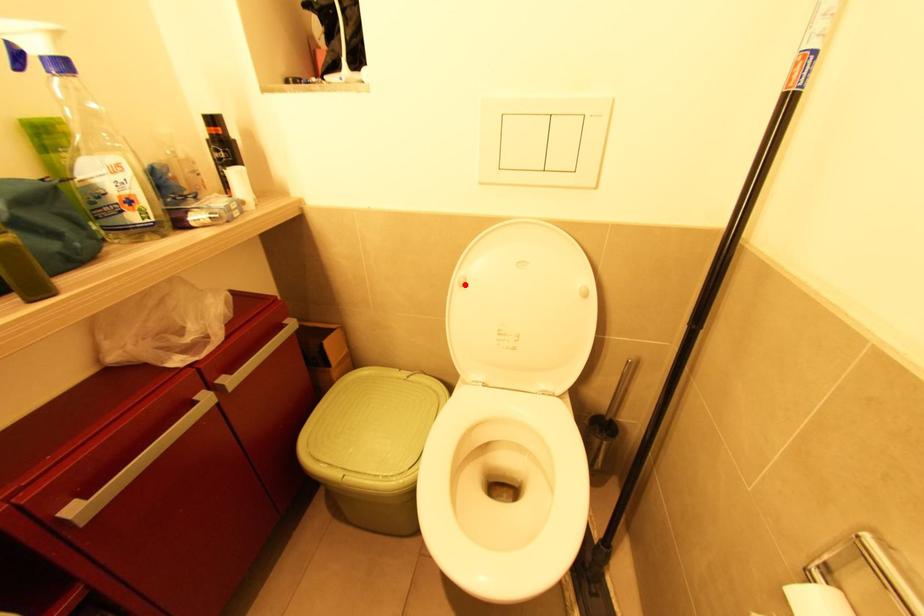
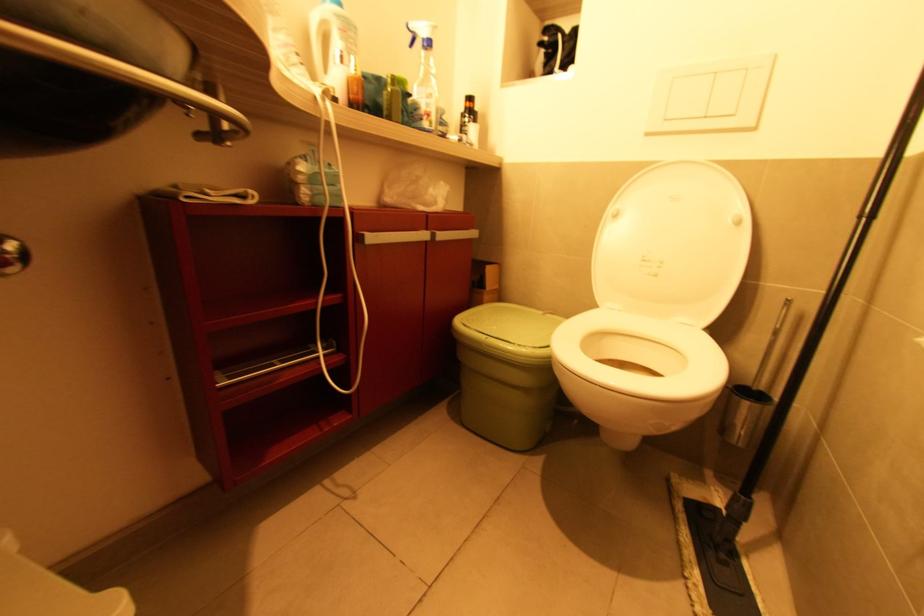
Locate, in the second image, the point that corresponds to the highlighted location in the first image.

(617, 217)